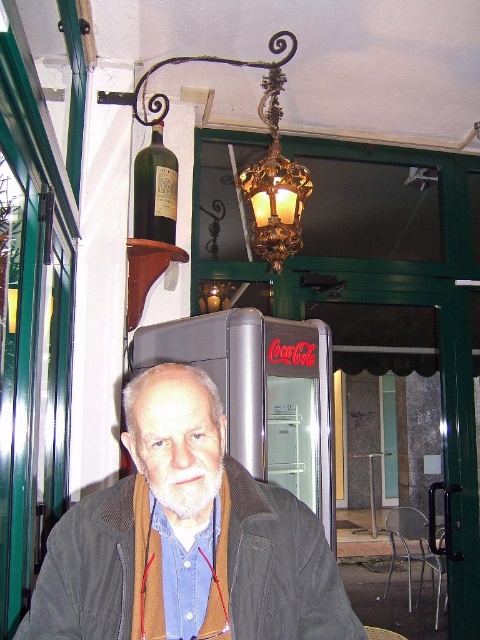
Is brown corduroy jacket at center above green glass bottle at upper left?

No, brown corduroy jacket at center is not above green glass bottle at upper left.

Which of these two, brown corduroy jacket at center or green glass bottle at upper left, stands shorter?

Standing shorter between the two is brown corduroy jacket at center.

Between point (27, 632) and point (140, 220), which one is positioned behind?

Point (140, 220)

This screenshot has height=640, width=480. Find the location of `brown corduroy jacket at center`. brown corduroy jacket at center is located at coordinates (188, 531).

Can you confirm if brown corduroy jacket at center is positioned to the right of metallic silver table at center?

Incorrect, brown corduroy jacket at center is not on the right side of metallic silver table at center.

Does brown corduroy jacket at center appear on the left side of metallic silver table at center?

Correct, you'll find brown corduroy jacket at center to the left of metallic silver table at center.

Does point (208, 538) lie behind point (381, 456)?

No, it is in front of (381, 456).

Locate an element on the screen. brown corduroy jacket at center is located at coordinates (188, 531).

Who is more forward, (149, 212) or (371, 531)?

Point (149, 212) is more forward.

Measure the distance between green glass bottle at upper left and metallic silver table at center.

The distance of green glass bottle at upper left from metallic silver table at center is 16.19 feet.

The height and width of the screenshot is (640, 480). In order to click on green glass bottle at upper left in this screenshot , I will do pos(155,189).

I want to click on green glass bottle at upper left, so click(x=155, y=189).